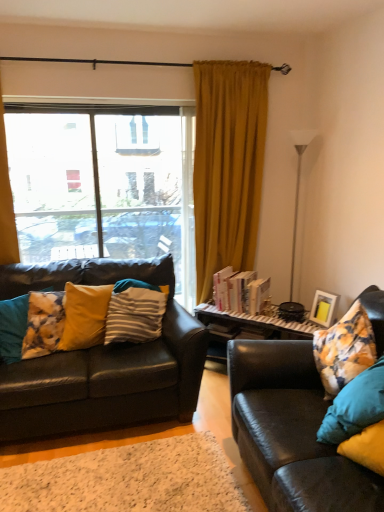
Question: Is white glossy floor lamp at right facing towards white textured rug at lower center?

Choices:
 (A) no
 (B) yes

Answer: (A)

Question: From a real-world perspective, is white glossy floor lamp at right located higher than white textured rug at lower center?

Choices:
 (A) no
 (B) yes

Answer: (B)

Question: From a real-world perspective, is white glossy floor lamp at right below white textured rug at lower center?

Choices:
 (A) no
 (B) yes

Answer: (A)

Question: Considering the relative sizes of white glossy floor lamp at right and white textured rug at lower center in the image provided, is white glossy floor lamp at right bigger than white textured rug at lower center?

Choices:
 (A) no
 (B) yes

Answer: (B)

Question: Considering the relative positions of white glossy floor lamp at right and white textured rug at lower center in the image provided, is white glossy floor lamp at right to the left of white textured rug at lower center from the viewer's perspective?

Choices:
 (A) no
 (B) yes

Answer: (A)

Question: From the image's perspective, is yellow fabric pillow at left, acting as the second pillow starting from the left, above or below fluffy yellow pillow at left, arranged as the third pillow when viewed from the right?

Choices:
 (A) above
 (B) below

Answer: (A)

Question: Is yellow fabric pillow at left, acting as the second pillow starting from the left, taller or shorter than fluffy yellow pillow at left, arranged as the third pillow when viewed from the right?

Choices:
 (A) short
 (B) tall

Answer: (B)

Question: Considering the positions of point (62, 334) and point (11, 321), is point (62, 334) closer or farther from the camera than point (11, 321)?

Choices:
 (A) farther
 (B) closer

Answer: (A)

Question: In terms of width, does yellow fabric pillow at left, acting as the second pillow starting from the left, look wider or thinner when compared to fluffy yellow pillow at left, which appears as the first pillow when viewed from the left?

Choices:
 (A) wide
 (B) thin

Answer: (B)

Question: In the image, is yellow fabric pillow at left, acting as the second pillow starting from the left, positioned in front of or behind matte black couch at right, the 2th studio couch when ordered from left to right?

Choices:
 (A) behind
 (B) front

Answer: (A)

Question: Considering the positions of yellow fabric pillow at left, the 2th pillow when ordered from right to left, and matte black couch at right, the first studio couch from the right, in the image, is yellow fabric pillow at left, the 2th pillow when ordered from right to left, bigger or smaller than matte black couch at right, the first studio couch from the right,?

Choices:
 (A) small
 (B) big

Answer: (A)

Question: Looking at their shapes, would you say yellow fabric pillow at left, the 2th pillow when ordered from right to left, is wider or thinner than matte black couch at right, the first studio couch from the right?

Choices:
 (A) thin
 (B) wide

Answer: (A)

Question: From the image's perspective, is yellow fabric pillow at left, acting as the second pillow starting from the left, above or below matte black couch at right, the 2th studio couch when ordered from left to right?

Choices:
 (A) above
 (B) below

Answer: (A)

Question: From the image's perspective, is mustard yellow velvet curtain at center, the second curtain from the left, located above or below white textured rug at lower center?

Choices:
 (A) above
 (B) below

Answer: (A)

Question: From a real-world perspective, is mustard yellow velvet curtain at center, the second curtain from the left, positioned above or below white textured rug at lower center?

Choices:
 (A) below
 (B) above

Answer: (B)